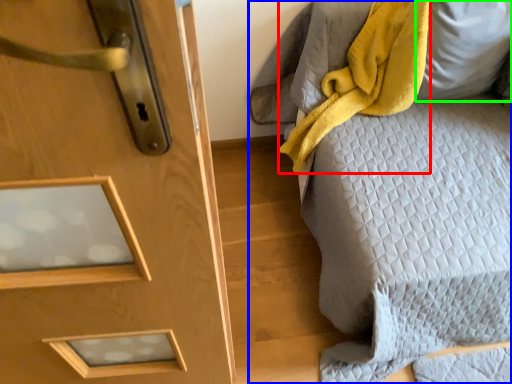
Question: Based on their relative distances, which object is farther from blanket (highlighted by a red box)? Choose from furniture (highlighted by a blue box) and pillow (highlighted by a green box).

Choices:
 (A) furniture
 (B) pillow

Answer: (A)